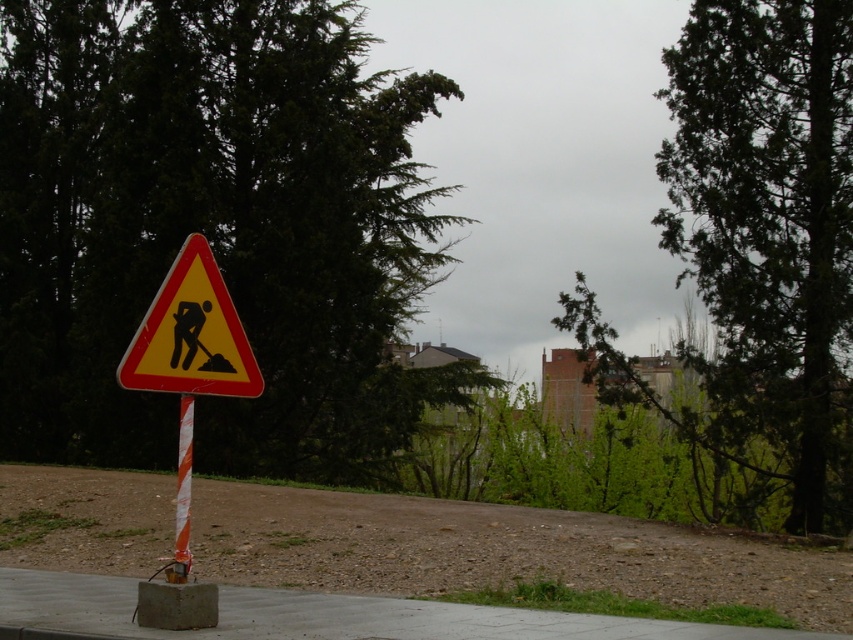
Looking at this image, between green leafy tree at upper right and yellow reflective triangle at center, which one appears on the left side from the viewer's perspective?

From the viewer's perspective, yellow reflective triangle at center appears more on the left side.

Is green leafy tree at upper right taller than yellow reflective triangle at center?

Yes, green leafy tree at upper right is taller than yellow reflective triangle at center.

Is point (817, 252) closer to viewer compared to point (131, 364)?

No, it is not.

At what (x,y) coordinates should I click in order to perform the action: click on green leafy tree at upper right. Please return your answer as a coordinate pair (x, y). Image resolution: width=853 pixels, height=640 pixels. Looking at the image, I should click on (756, 240).

Between point (672, 198) and point (183, 429), which one is positioned in front?

Point (183, 429) is more forward.

Does green leafy tree at upper right have a lesser height compared to orange striped pole at center?

Incorrect, green leafy tree at upper right's height does not fall short of orange striped pole at center's.

The image size is (853, 640). I want to click on green leafy tree at upper right, so click(x=756, y=240).

Locate an element on the screen. green leafy tree at upper right is located at coordinates (756, 240).

Who is positioned more to the left, concrete at center or orange striped pole at center?

From the viewer's perspective, orange striped pole at center appears more on the left side.

Does concrete at center have a larger size compared to orange striped pole at center?

Yes, concrete at center is bigger than orange striped pole at center.

Where is `concrete at center`? The width and height of the screenshot is (853, 640). concrete at center is located at coordinates (325, 616).

Locate an element on the screen. The height and width of the screenshot is (640, 853). concrete at center is located at coordinates (325, 616).